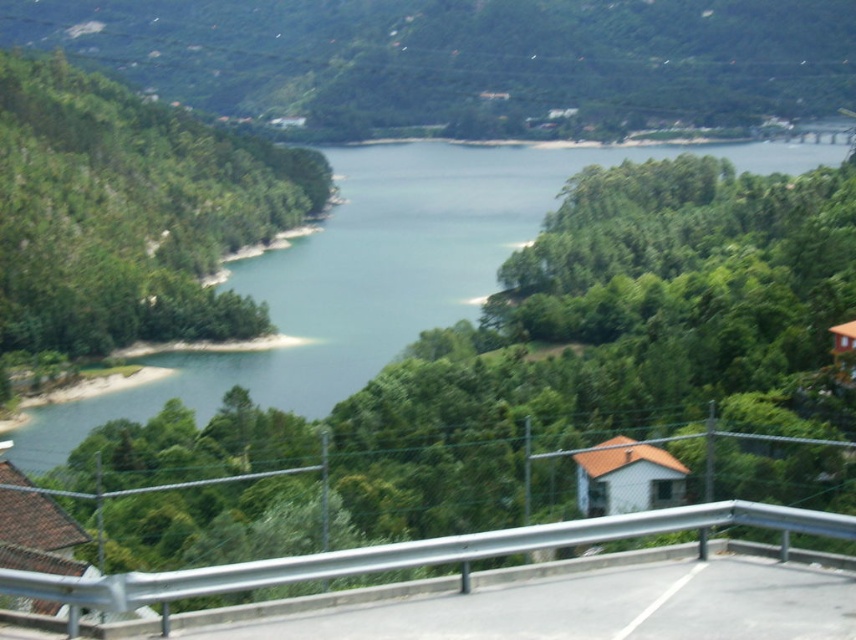
Question: Can you confirm if green water at center is positioned to the left of silver metallic guardrail at center?

Choices:
 (A) yes
 (B) no

Answer: (A)

Question: Can you confirm if green water at center is wider than silver metallic guardrail at center?

Choices:
 (A) no
 (B) yes

Answer: (B)

Question: Among these points, which one is nearest to the camera?

Choices:
 (A) (217, 568)
 (B) (417, 188)

Answer: (A)

Question: Can you confirm if green water at center is thinner than silver metallic guardrail at center?

Choices:
 (A) no
 (B) yes

Answer: (A)

Question: Which point appears closest to the camera in this image?

Choices:
 (A) (290, 292)
 (B) (144, 586)

Answer: (B)